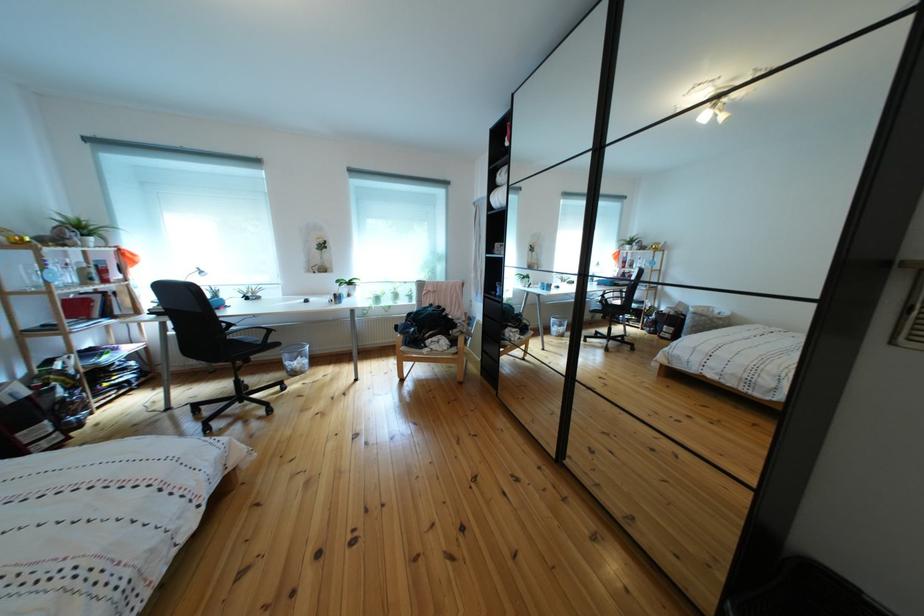
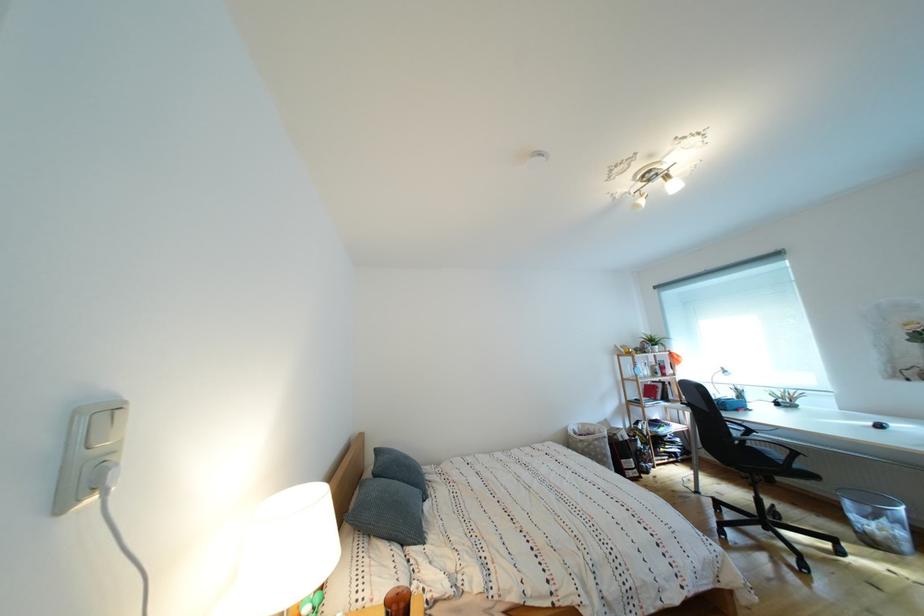
The point at [310,363] is marked in the first image. Where is the corresponding point in the second image?

(896, 527)